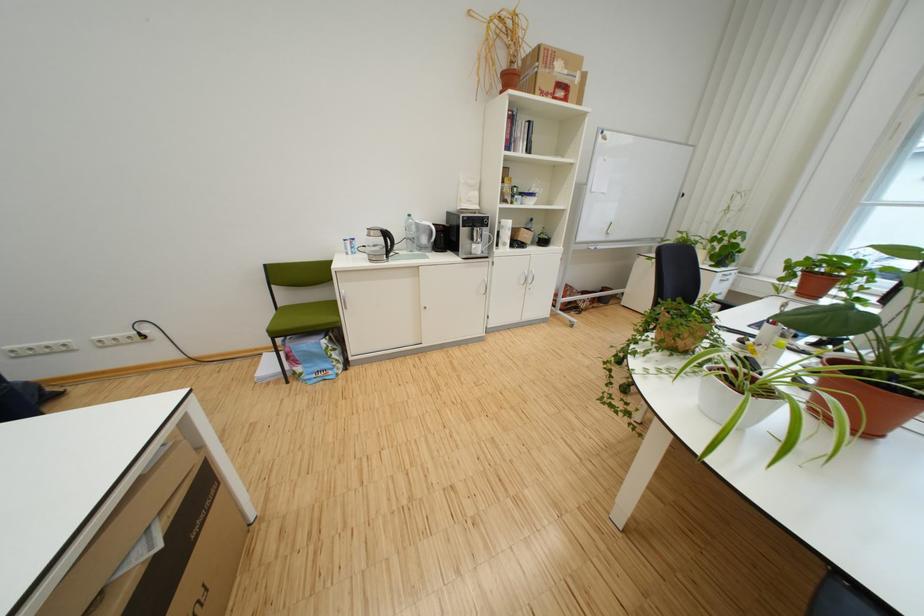
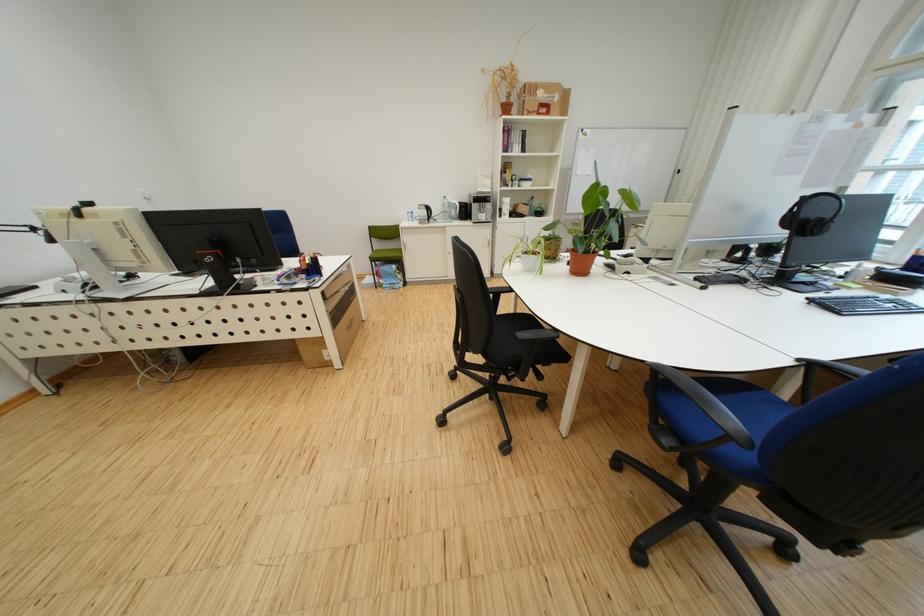
Find the pixel in the second image that matches (553,95) in the first image.

(541, 115)